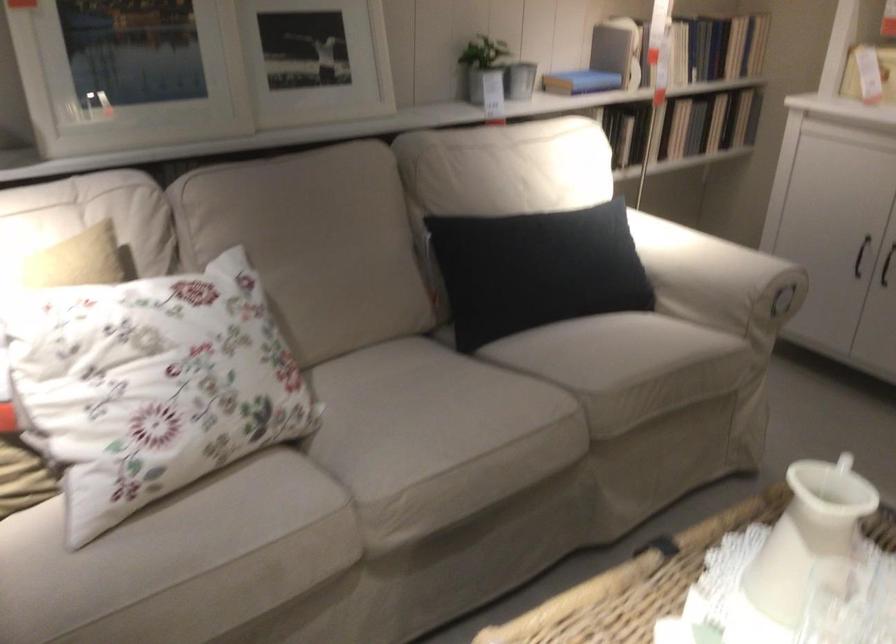
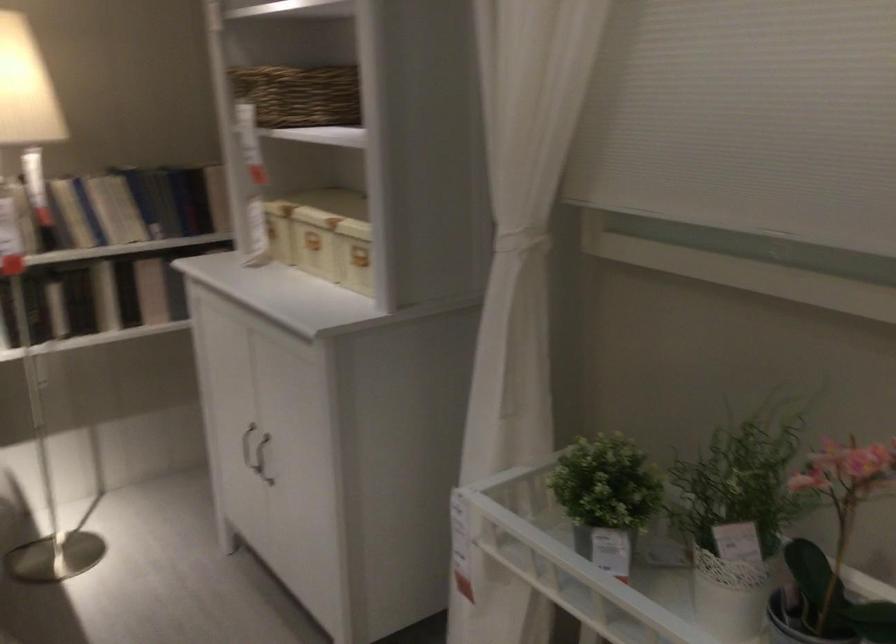
Find the pixel in the second image that matches the point at 702,116 in the first image.

(151, 290)